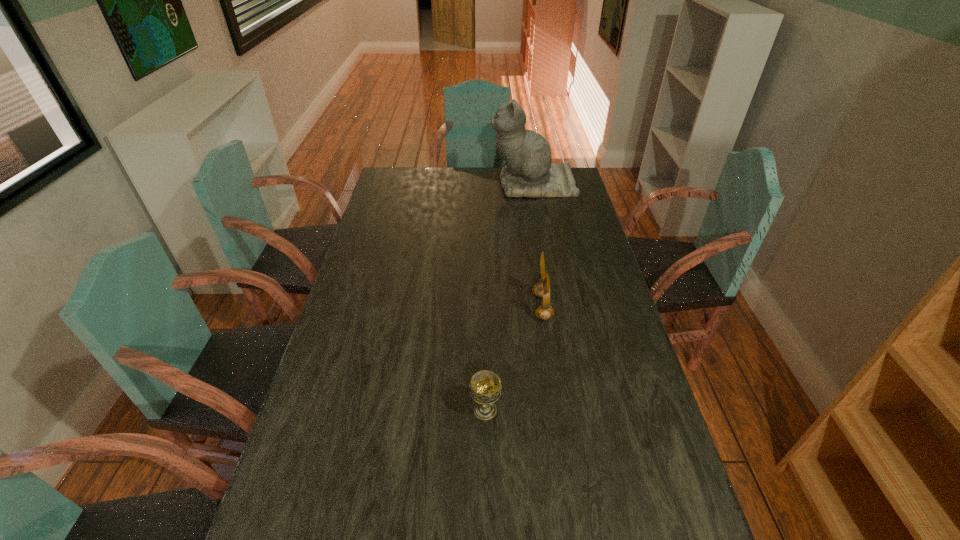
What are the coordinates of `the tallest object` in the screenshot? It's located at (528, 172).

Locate an element on the screen. the farthest object is located at coordinates (528, 172).

You are a GUI agent. You are given a task and a screenshot of the screen. Output one action in this format:
    pyautogui.click(x=<x>, y=<y>)
    Task: Click on the earphone
    This screenshot has height=540, width=960.
    Given the screenshot: What is the action you would take?
    pyautogui.click(x=542, y=289)

Locate an element on the screen. the second tallest object is located at coordinates (542, 289).

Image resolution: width=960 pixels, height=540 pixels. Identify the location of the shortest object. point(485,387).

You are a GUI agent. You are given a task and a screenshot of the screen. Output one action in this format:
    pyautogui.click(x=<x>, y=<y>)
    Task: Click on the nearest object
    
    Given the screenshot: What is the action you would take?
    pyautogui.click(x=485, y=387)

Identify the location of blank area located 0.350m on the front-facing side of the tallest object. (414, 184).

This screenshot has width=960, height=540. I want to click on vacant space situated 0.200m on the front-facing side of the tallest object, so click(446, 184).

Locate an element on the screen. Image resolution: width=960 pixels, height=540 pixels. vacant space located on the front-facing side of the tallest object is located at coordinates (443, 184).

Locate an element on the screen. free location located 0.240m on the front-facing side of the earphone is located at coordinates (459, 307).